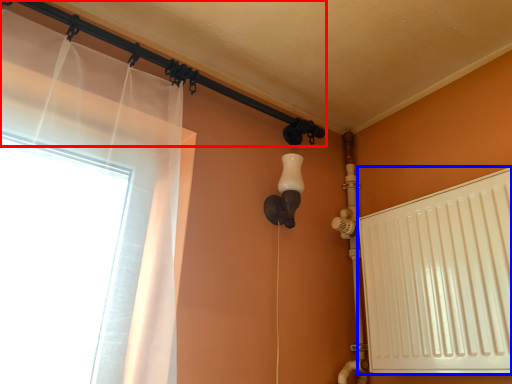
Question: Which object appears closest to the camera in this image, pipe (highlighted by a red box) or radiator (highlighted by a blue box)?

Choices:
 (A) pipe
 (B) radiator

Answer: (B)